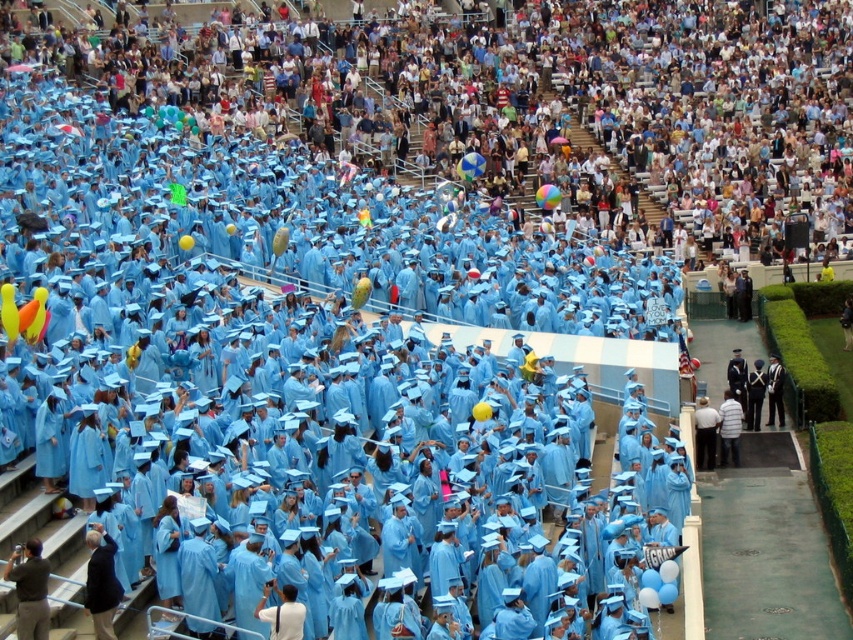
Looking at this image, you are standing at the center of the stadium and want to locate the dark gray uniform at lower left. Based on the coordinates provided, in which direction should you look to find it?

The dark gray uniform at lower left is located at coordinates point (28, 589), which means you should look to the lower left direction to find it.

You are a photographer at the graduation ceremony. You want to take a photo that includes both the dark gray uniform at lower left and the black uniform at center. Which uniform should you position closer to the left side of the frame to include both?

To include both the dark gray uniform at lower left and the black uniform at center in the photo, position the dark gray uniform at lower left closer to the left side of the frame since it is already to the left of the black uniform at center.

You are a photographer at the graduation ceremony. You want to take a photo that includes both point (10, 568) and point (779, 396). Which point will appear larger in the photo?

Point (10, 568) is closer to the camera than point (779, 396), so it will appear larger in the photo.